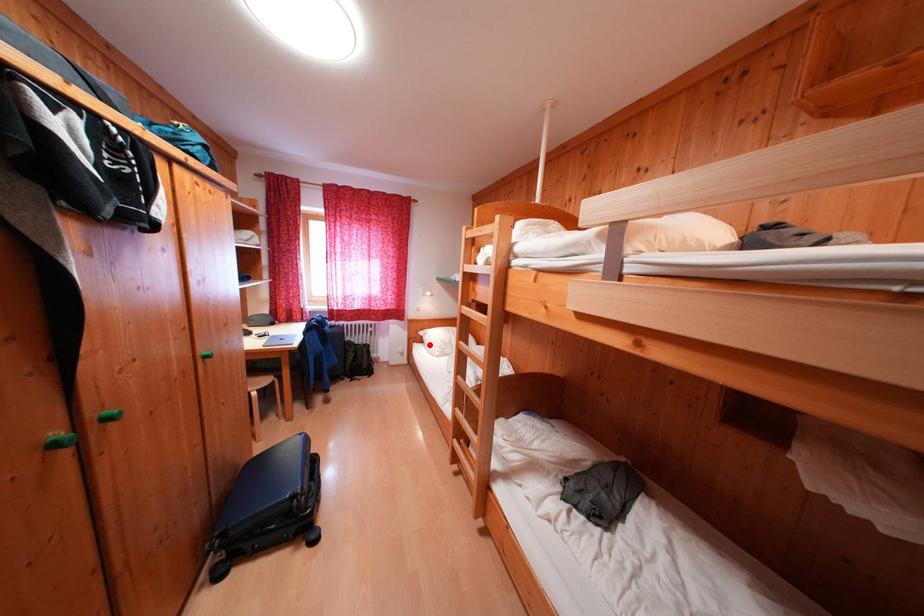
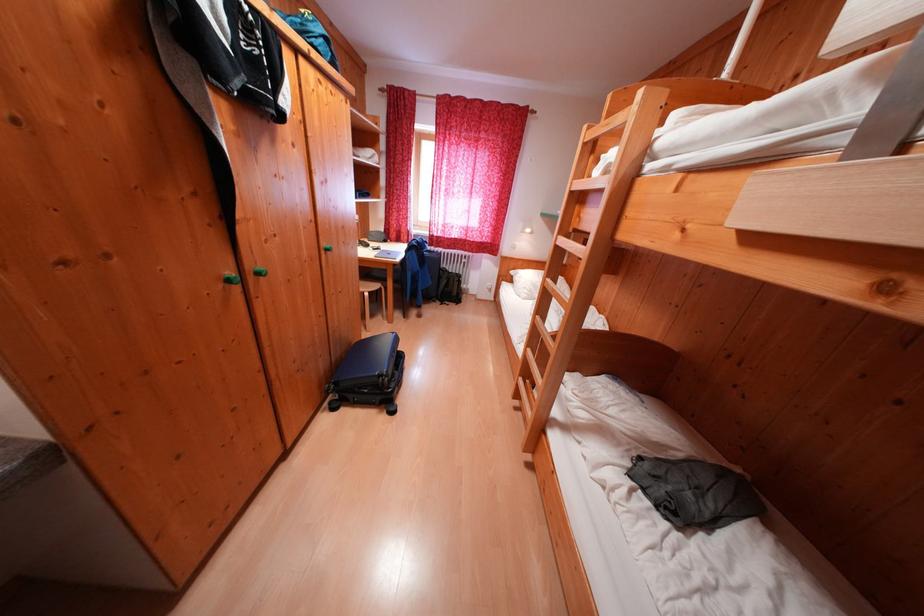
Question: I am providing you with two images of the same scene from different viewpoints. In image1, a red point is highlighted. Considering the same 3D point in image2, which of the following is correct?

Choices:
 (A) It is closer
 (B) It is farther

Answer: (A)